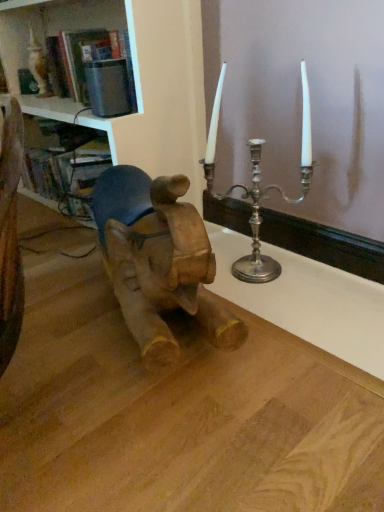
Question: Considering the relative sizes of wooden table at center and white glossy bookshelf at upper left in the image provided, is wooden table at center wider than white glossy bookshelf at upper left?

Choices:
 (A) no
 (B) yes

Answer: (B)

Question: Does wooden table at center touch white glossy bookshelf at upper left?

Choices:
 (A) yes
 (B) no

Answer: (B)

Question: Is wooden table at center in front of white glossy bookshelf at upper left?

Choices:
 (A) yes
 (B) no

Answer: (A)

Question: Is wooden table at center outside white glossy bookshelf at upper left?

Choices:
 (A) yes
 (B) no

Answer: (A)

Question: Is white glossy bookshelf at upper left surrounded by wooden table at center?

Choices:
 (A) no
 (B) yes

Answer: (A)

Question: Considering the relative positions of wooden table at center and white glossy bookshelf at upper left in the image provided, is wooden table at center behind white glossy bookshelf at upper left?

Choices:
 (A) no
 (B) yes

Answer: (A)

Question: Is white glossy bookshelf at upper left not near wooden table at center?

Choices:
 (A) yes
 (B) no

Answer: (B)

Question: Is white glossy bookshelf at upper left to the left of wooden table at center from the viewer's perspective?

Choices:
 (A) yes
 (B) no

Answer: (A)

Question: Is white glossy bookshelf at upper left not within wooden table at center?

Choices:
 (A) no
 (B) yes

Answer: (B)

Question: Is wooden table at center located within white glossy bookshelf at upper left?

Choices:
 (A) no
 (B) yes

Answer: (A)

Question: Is white glossy bookshelf at upper left oriented towards wooden table at center?

Choices:
 (A) yes
 (B) no

Answer: (B)

Question: From the image's perspective, would you say white glossy bookshelf at upper left is shown under wooden table at center?

Choices:
 (A) no
 (B) yes

Answer: (A)

Question: Is wooden baby elephant at left smaller than wooden table at center?

Choices:
 (A) no
 (B) yes

Answer: (B)